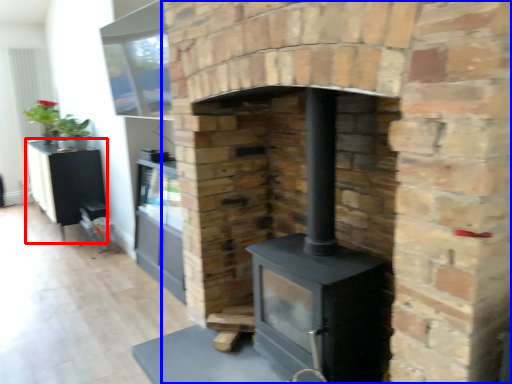
Question: Which point is further to the camera, entertainment center (highlighted by a red box) or fireplace (highlighted by a blue box)?

Choices:
 (A) entertainment center
 (B) fireplace

Answer: (A)